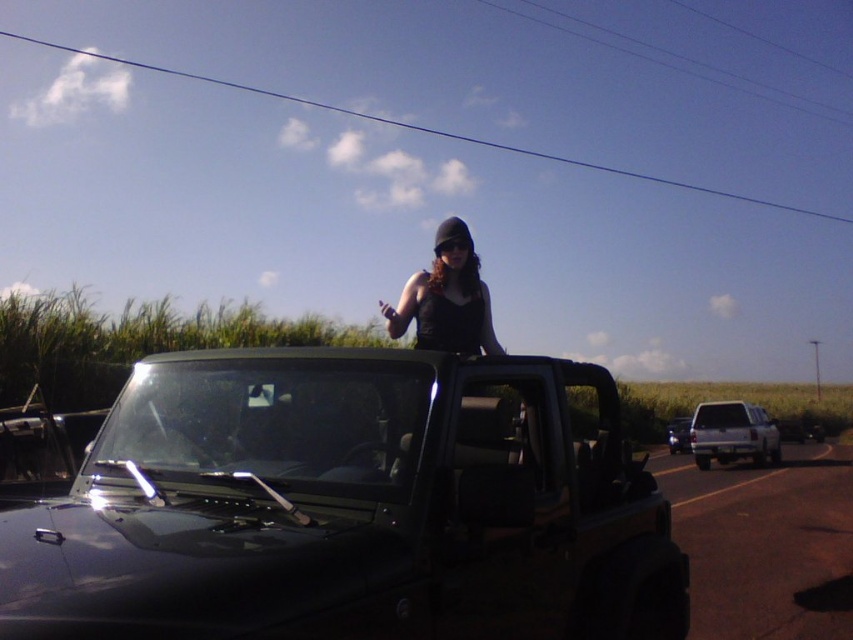
Question: Is matte black tank top at center closer to camera compared to silver metallic truck at right?

Choices:
 (A) no
 (B) yes

Answer: (B)

Question: Where is matte black tank top at center located in relation to white matte truck at right in the image?

Choices:
 (A) left
 (B) right

Answer: (A)

Question: Which object is positioned farthest from the transparent glass windshield at center?

Choices:
 (A) black matte jeep at center
 (B) silver metallic truck at right
 (C) matte black tank top at center
 (D) white matte truck at right

Answer: (B)

Question: Is black matte jeep at center positioned at the back of white matte truck at right?

Choices:
 (A) no
 (B) yes

Answer: (A)

Question: Which point is closer to the camera?

Choices:
 (A) white matte truck at right
 (B) matte black tank top at center

Answer: (B)

Question: Among these objects, which one is farthest from the camera?

Choices:
 (A) matte black tank top at center
 (B) transparent glass windshield at center
 (C) silver metallic truck at right

Answer: (C)